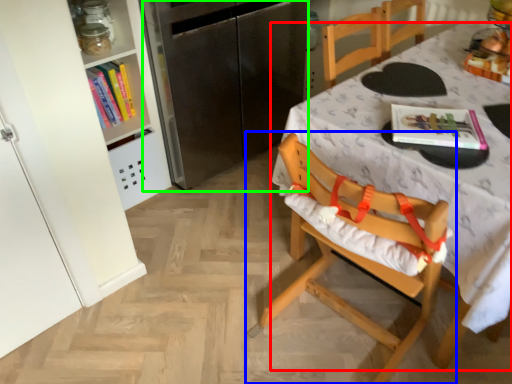
Question: Which is farther away from table (highlighted by a red box)? chair (highlighted by a blue box) or appliance (highlighted by a green box)?

Choices:
 (A) chair
 (B) appliance

Answer: (B)